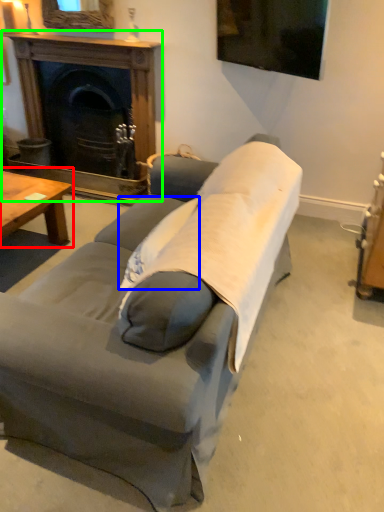
Question: Estimate the real-world distances between objects in this image. Which object is farther from coffee table (highlighted by a red box), pillow (highlighted by a blue box) or fireplace (highlighted by a green box)?

Choices:
 (A) pillow
 (B) fireplace

Answer: (A)